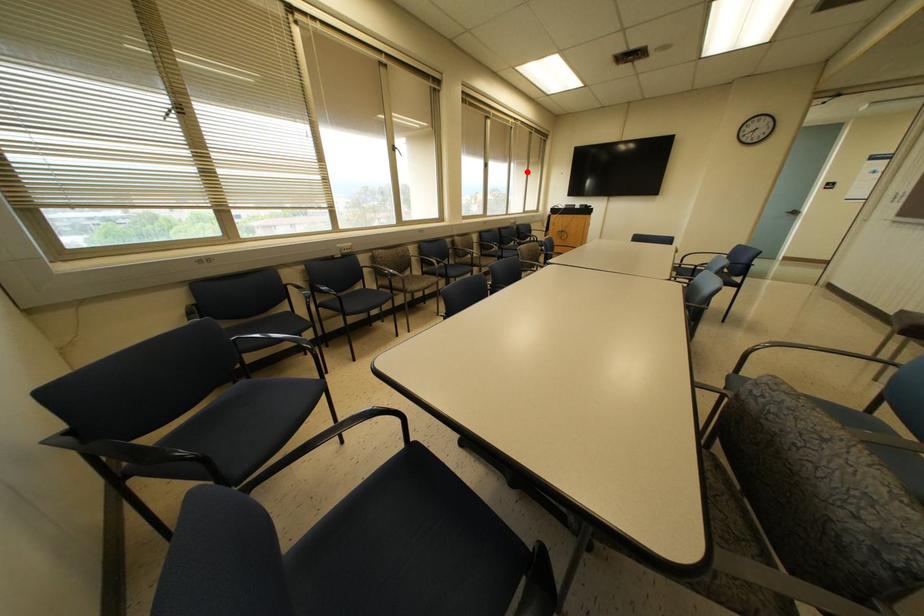
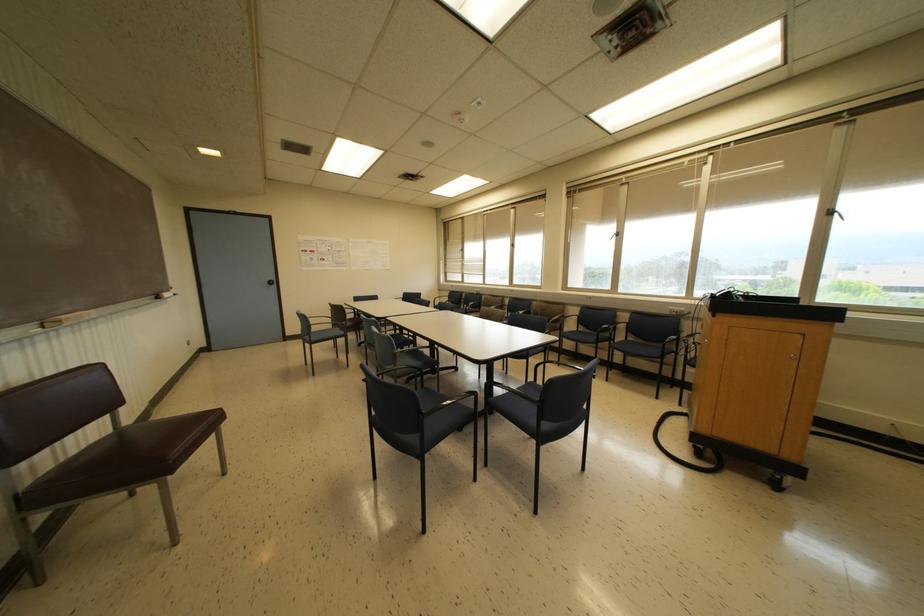
Question: I am providing you with two images of the same scene from different viewpoints. Image1 has a red point marked. In image2, the corresponding 3D location appears at what relative position? Reply with the corresponding letter.

Choices:
 (A) Closer
 (B) Farther

Answer: (B)